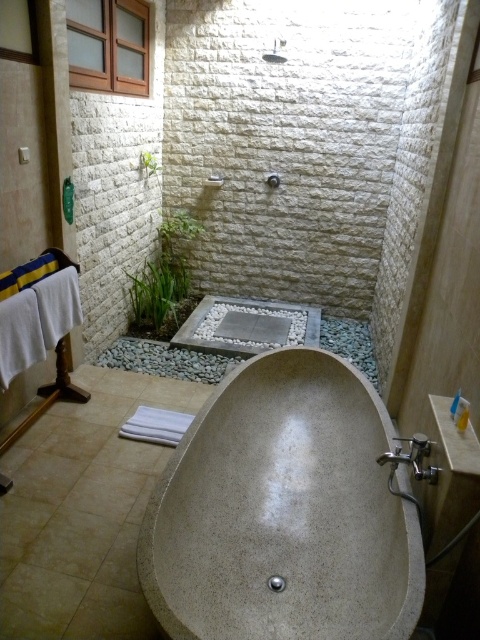
Does matte stone bathtub at center have a greater width compared to satin nickel faucet at lower right?

Yes.

Who is more forward, (x=371, y=410) or (x=396, y=464)?

Point (x=396, y=464)

Locate an element on the screen. This screenshot has width=480, height=640. matte stone bathtub at center is located at coordinates (283, 513).